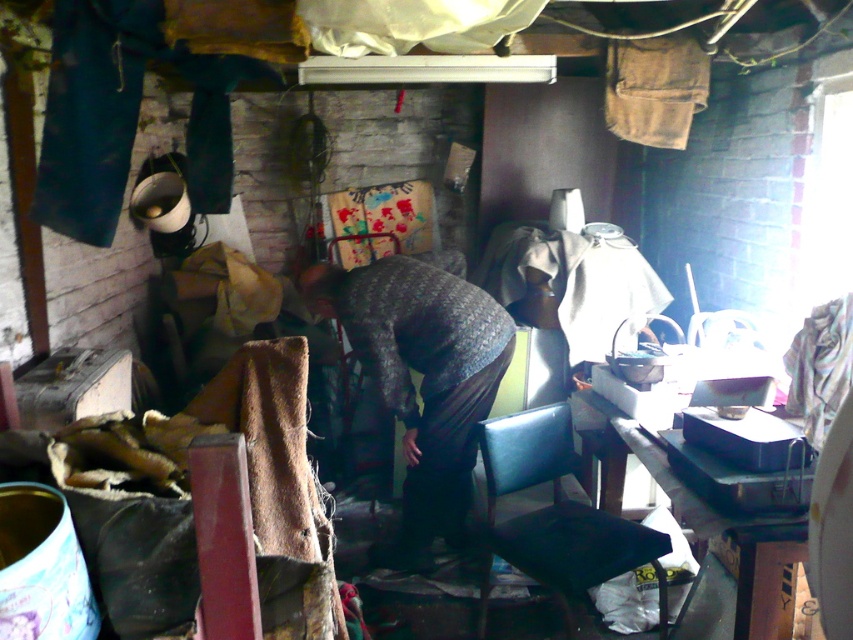
Question: Is black leather chair at lower center closer to camera compared to black plastic table at lower right?

Choices:
 (A) yes
 (B) no

Answer: (B)

Question: Among these points, which one is farthest from the camera?

Choices:
 (A) (741, 632)
 (B) (654, 532)
 (C) (404, 266)

Answer: (C)

Question: Does knitted fabric sweater at center appear on the right side of black leather chair at lower center?

Choices:
 (A) no
 (B) yes

Answer: (A)

Question: From the image, what is the correct spatial relationship of knitted fabric sweater at center in relation to black leather chair at lower center?

Choices:
 (A) above
 (B) below

Answer: (A)

Question: Which point appears closest to the camera in this image?

Choices:
 (A) (582, 438)
 (B) (492, 499)

Answer: (B)

Question: Which point is closer to the camera?

Choices:
 (A) (547, 412)
 (B) (712, 512)

Answer: (B)